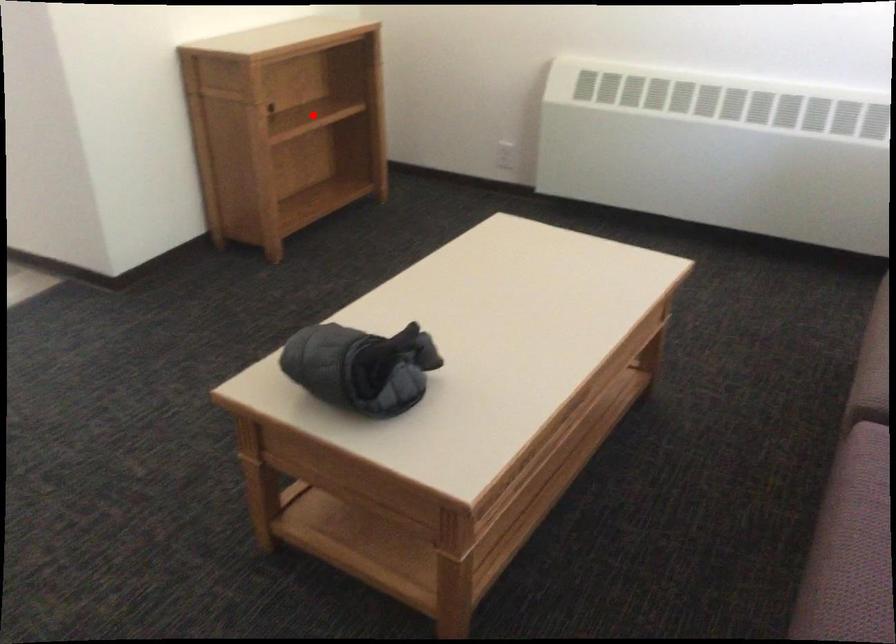
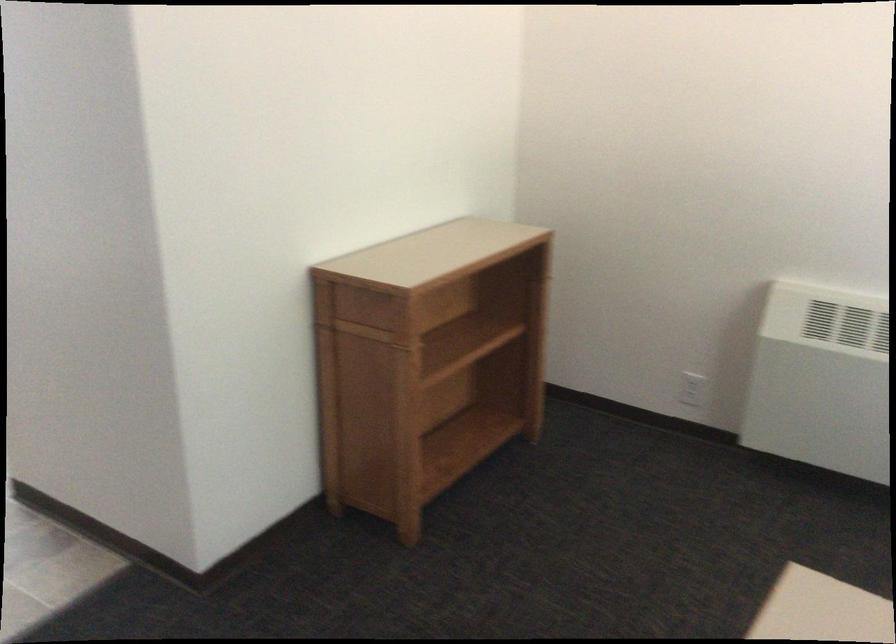
The point at the highlighted location is marked in the first image. Where is the corresponding point in the second image?

(462, 345)